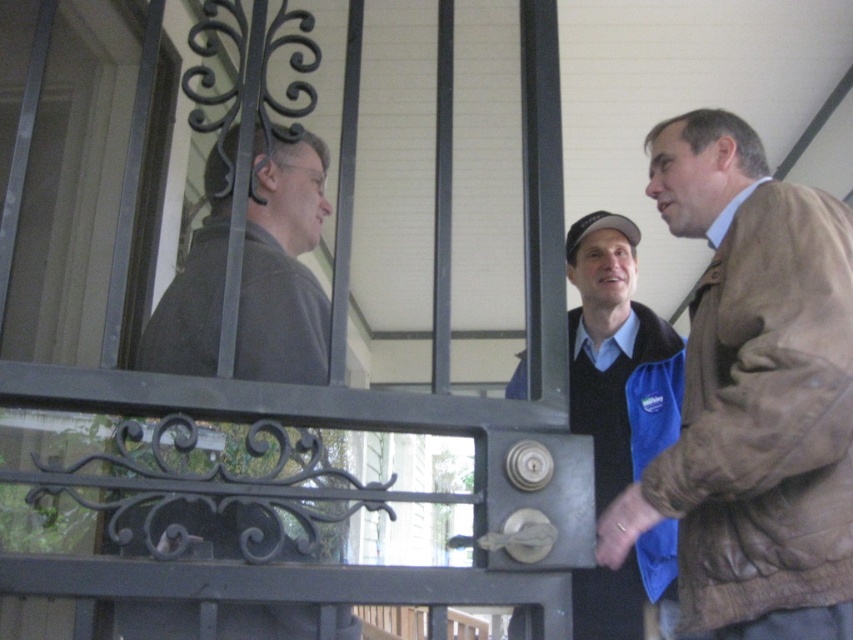
Is point (814, 547) farther from camera compared to point (293, 243)?

No, (814, 547) is in front of (293, 243).

Between point (722, 349) and point (251, 218), which one is positioned in front?

Point (722, 349) is more forward.

This screenshot has height=640, width=853. What do you see at coordinates (753, 396) in the screenshot? I see `brown leather jacket at right` at bounding box center [753, 396].

This screenshot has height=640, width=853. What are the coordinates of `brown leather jacket at right` in the screenshot? It's located at (753, 396).

Can you confirm if brown leather jacket at right is wider than blue fabric vest at center?

Yes, brown leather jacket at right is wider than blue fabric vest at center.

Who is higher up, brown leather jacket at right or blue fabric vest at center?

Positioned higher is brown leather jacket at right.

Find the location of `brown leather jacket at right`. brown leather jacket at right is located at coordinates coord(753,396).

Image resolution: width=853 pixels, height=640 pixels. Find the location of `brown leather jacket at right`. brown leather jacket at right is located at coordinates (753, 396).

Does dark gray jacket at left have a larger size compared to blue fabric vest at center?

No, dark gray jacket at left is not bigger than blue fabric vest at center.

The width and height of the screenshot is (853, 640). Describe the element at coordinates (283, 268) in the screenshot. I see `dark gray jacket at left` at that location.

Is point (158, 627) positioned after point (668, 545)?

No, (158, 627) is in front of (668, 545).

Identify the location of dark gray jacket at left. (283, 268).